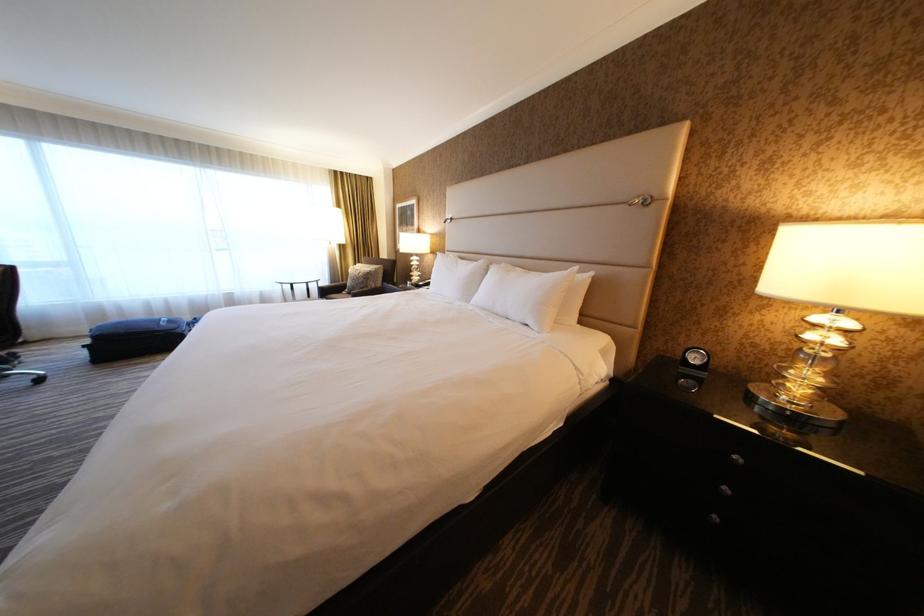
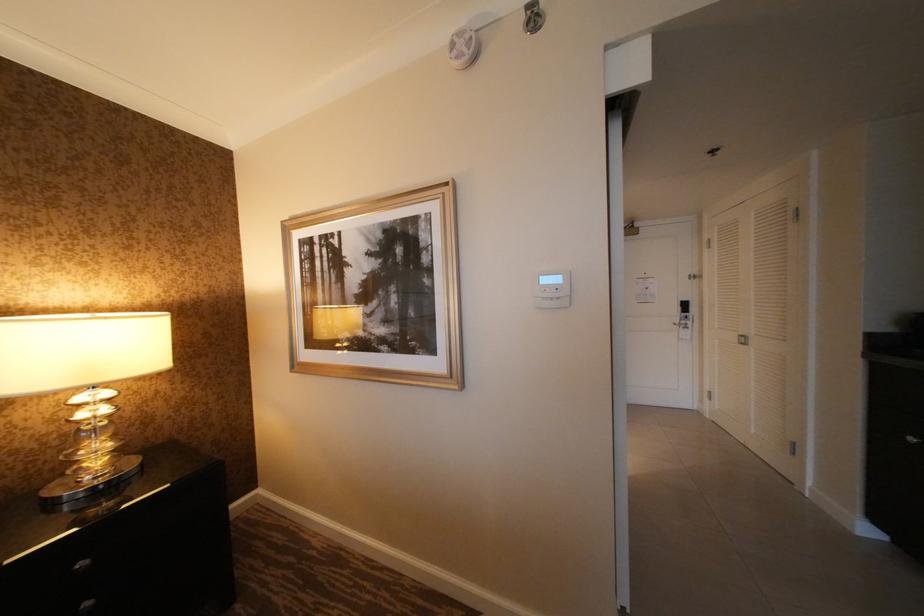
Question: Based on the continuous images, in which direction is the camera rotating? Reply with the corresponding letter.

Choices:
 (A) Left
 (B) Right
 (C) Up
 (D) Down

Answer: (B)